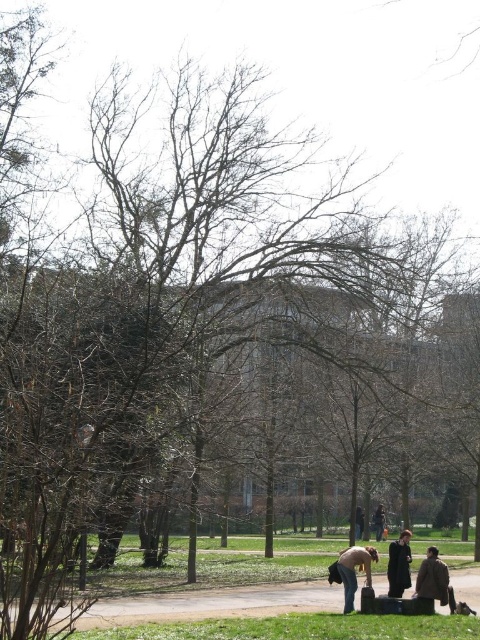
Does dark wool coat at lower right have a greater width compared to dark brown leather jacket at lower center?

No, dark wool coat at lower right is not wider than dark brown leather jacket at lower center.

Is point (396, 582) positioned in front of point (382, 534)?

Yes, it is.

What are the coordinates of `dark wool coat at lower right` in the screenshot? It's located at (398, 564).

Is point (276, 604) positioned after point (375, 557)?

That is True.

Between green grass at lower center and brown leather jacket at lower center, which one has more height?

green grass at lower center is taller.

Is point (203, 602) less distant than point (367, 584)?

No, (203, 602) is further to viewer.

At what (x,y) coordinates should I click in order to perform the action: click on green grass at lower center. Please return your answer as a coordinate pair (x, y). The width and height of the screenshot is (480, 640). Looking at the image, I should click on (215, 604).

Is brown wool coat at lower right to the left of brown leather jacket at lower center from the viewer's perspective?

Incorrect, brown wool coat at lower right is not on the left side of brown leather jacket at lower center.

Measure the distance between point (423, 572) and camera.

A distance of 17.36 meters exists between point (423, 572) and camera.

Image resolution: width=480 pixels, height=640 pixels. What do you see at coordinates (433, 579) in the screenshot?
I see `brown wool coat at lower right` at bounding box center [433, 579].

This screenshot has width=480, height=640. What are the coordinates of `brown wool coat at lower right` in the screenshot? It's located at (433, 579).